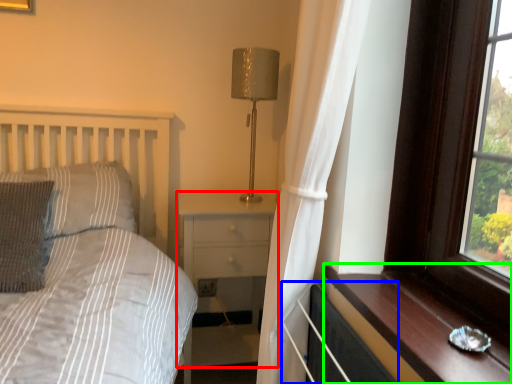
Question: Considering the real-world distances, which object is closest to nightstand (highlighted by a red box)? radiator (highlighted by a blue box) or window sill (highlighted by a green box).

Choices:
 (A) radiator
 (B) window sill

Answer: (A)